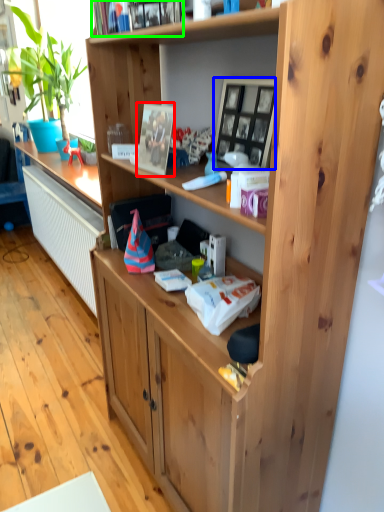
Question: Which is nearer to the picture frame (highlighted by a red box)? picture frame (highlighted by a blue box) or book (highlighted by a green box).

Choices:
 (A) picture frame
 (B) book

Answer: (A)